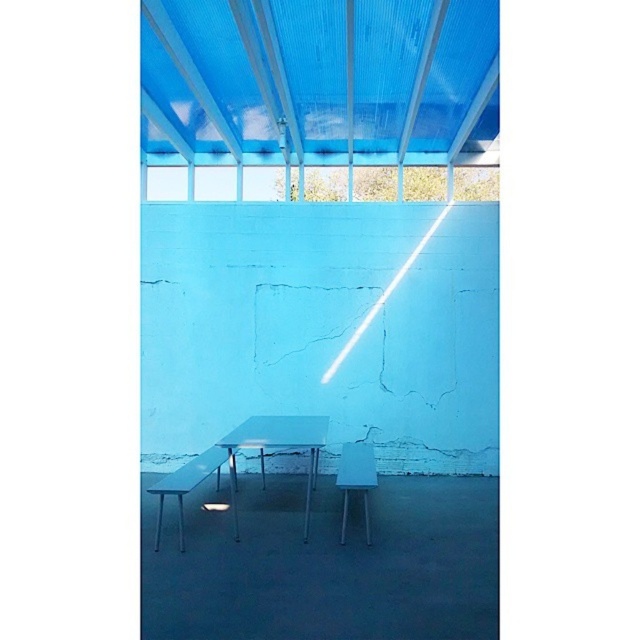
Does metallic silver table at center have a greater width compared to matte blue plastic chair at center?

Correct, the width of metallic silver table at center exceeds that of matte blue plastic chair at center.

Between metallic silver table at center and matte blue plastic chair at center, which one appears on the right side from the viewer's perspective?

matte blue plastic chair at center is more to the right.

Where is `metallic silver table at center`? This screenshot has height=640, width=640. metallic silver table at center is located at coordinates (276, 449).

The height and width of the screenshot is (640, 640). Find the location of `metallic silver table at center`. metallic silver table at center is located at coordinates (276, 449).